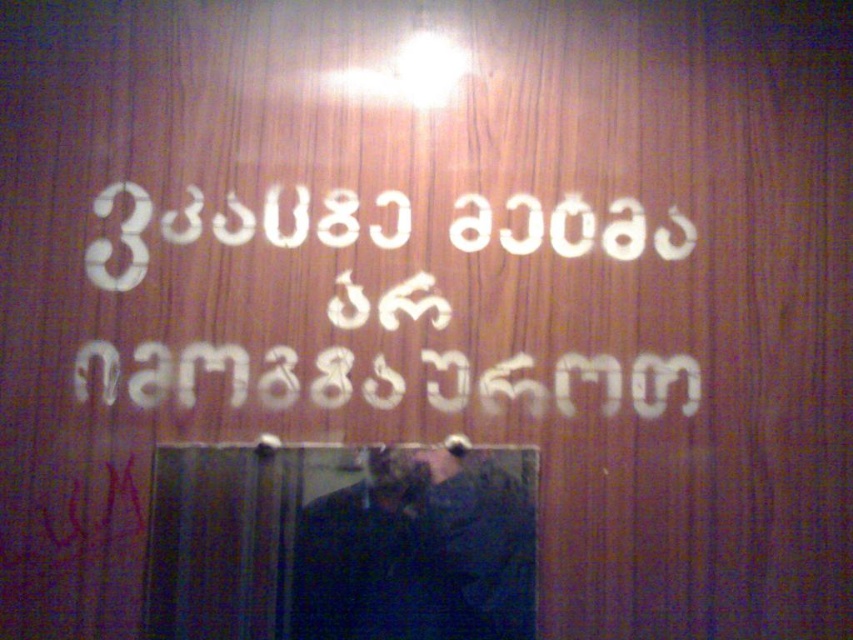
Based on the photo, you are a security guard in a museum and you notice the white plastic sign at center and the dark fabric man at center. Which object is positioned higher in the scene?

The white plastic sign at center is located above the dark fabric man at center, so it is positioned higher.

You are standing in a room where the wooden surface with Malayalam script is placed. You see a white plastic sign at center and a dark fabric man at center. Which object is closer to you?

The white plastic sign at center is closer to you because the dark fabric man at center is behind it.

You are standing in a room with a wooden surface. You see a white plastic sign at center and a dark fabric man at center. Which object is wider?

The white plastic sign at center is wider than the dark fabric man at center.